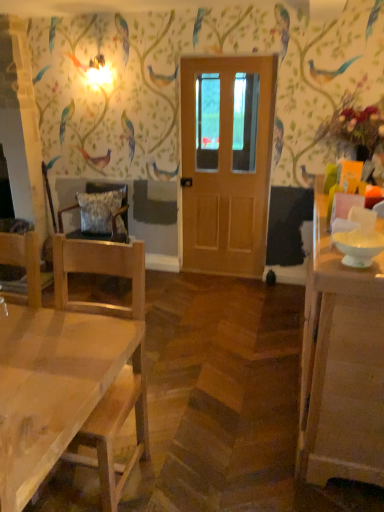
Question: Is wooden chair with cushion at left, placed as the first chair when sorted from back to front, next to white glossy cabinet at right?

Choices:
 (A) yes
 (B) no

Answer: (B)

Question: Is wooden chair with cushion at left, placed as the first chair when sorted from back to front, far away from white glossy cabinet at right?

Choices:
 (A) yes
 (B) no

Answer: (A)

Question: Is wooden chair with cushion at left, the second chair when ordered from front to back, facing away from white glossy cabinet at right?

Choices:
 (A) yes
 (B) no

Answer: (B)

Question: Does wooden chair with cushion at left, the second chair when ordered from front to back, have a lesser width compared to white glossy cabinet at right?

Choices:
 (A) no
 (B) yes

Answer: (A)

Question: From the image's perspective, does wooden chair with cushion at left, the second chair when ordered from front to back, appear higher than white glossy cabinet at right?

Choices:
 (A) no
 (B) yes

Answer: (B)

Question: Is point (115, 415) closer or farther from the camera than point (107, 217)?

Choices:
 (A) closer
 (B) farther

Answer: (A)

Question: Is natural wood chair at left, acting as the 2th chair starting from the back, inside the boundaries of fluffy fabric pillow at left, or outside?

Choices:
 (A) outside
 (B) inside

Answer: (A)

Question: Looking at the image, does natural wood chair at left, arranged as the 1th chair when viewed from the front, seem bigger or smaller compared to fluffy fabric pillow at left?

Choices:
 (A) small
 (B) big

Answer: (B)

Question: Considering the positions of natural wood chair at left, acting as the 2th chair starting from the back, and fluffy fabric pillow at left in the image, is natural wood chair at left, acting as the 2th chair starting from the back, taller or shorter than fluffy fabric pillow at left?

Choices:
 (A) short
 (B) tall

Answer: (B)

Question: In terms of width, does wooden chair with cushion at left, placed as the first chair when sorted from back to front, look wider or thinner when compared to fluffy fabric pillow at left?

Choices:
 (A) thin
 (B) wide

Answer: (B)

Question: From the image's perspective, is wooden chair with cushion at left, placed as the first chair when sorted from back to front, located above or below fluffy fabric pillow at left?

Choices:
 (A) above
 (B) below

Answer: (B)

Question: Considering the positions of wooden chair with cushion at left, placed as the first chair when sorted from back to front, and fluffy fabric pillow at left in the image, is wooden chair with cushion at left, placed as the first chair when sorted from back to front, taller or shorter than fluffy fabric pillow at left?

Choices:
 (A) short
 (B) tall

Answer: (B)

Question: From a real-world perspective, is wooden chair with cushion at left, the second chair when ordered from front to back, positioned above or below fluffy fabric pillow at left?

Choices:
 (A) above
 (B) below

Answer: (B)

Question: Is natural wood chair at left, arranged as the 1th chair when viewed from the front, taller or shorter than wooden chair with cushion at left, placed as the first chair when sorted from back to front?

Choices:
 (A) short
 (B) tall

Answer: (B)

Question: In the image, is natural wood chair at left, acting as the 2th chair starting from the back, positioned in front of or behind wooden chair with cushion at left, the second chair when ordered from front to back?

Choices:
 (A) behind
 (B) front

Answer: (B)